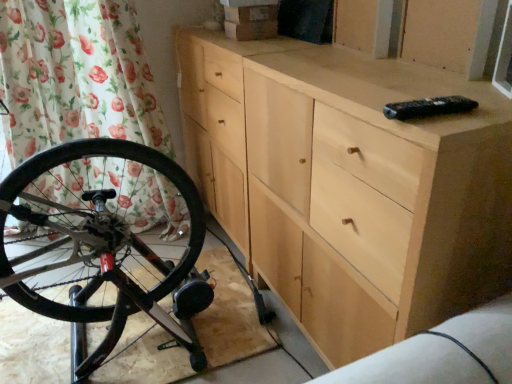
Question: Is clear glass window screen at upper right looking in the opposite direction of natural wood chest of drawers at center?

Choices:
 (A) yes
 (B) no

Answer: (B)

Question: Are clear glass window screen at upper right and natural wood chest of drawers at center located far from each other?

Choices:
 (A) no
 (B) yes

Answer: (A)

Question: Can you confirm if clear glass window screen at upper right is taller than natural wood chest of drawers at center?

Choices:
 (A) no
 (B) yes

Answer: (A)

Question: Is clear glass window screen at upper right oriented towards natural wood chest of drawers at center?

Choices:
 (A) yes
 (B) no

Answer: (B)

Question: Considering the relative positions of clear glass window screen at upper right and natural wood chest of drawers at center in the image provided, is clear glass window screen at upper right in front of natural wood chest of drawers at center?

Choices:
 (A) yes
 (B) no

Answer: (B)

Question: Considering the positions of clear glass window screen at upper right and natural wood chest of drawers at center in the image, is clear glass window screen at upper right wider or thinner than natural wood chest of drawers at center?

Choices:
 (A) thin
 (B) wide

Answer: (A)

Question: Does point (506, 94) appear closer or farther from the camera than point (474, 122)?

Choices:
 (A) farther
 (B) closer

Answer: (A)

Question: Is clear glass window screen at upper right taller or shorter than natural wood chest of drawers at center?

Choices:
 (A) tall
 (B) short

Answer: (B)

Question: Considering the positions of clear glass window screen at upper right and natural wood chest of drawers at center in the image, is clear glass window screen at upper right bigger or smaller than natural wood chest of drawers at center?

Choices:
 (A) big
 (B) small

Answer: (B)

Question: Do you think floral fabric curtain at left is within clear glass window screen at upper right, or outside of it?

Choices:
 (A) outside
 (B) inside

Answer: (A)

Question: Considering the positions of point (87, 122) and point (497, 71), is point (87, 122) closer or farther from the camera than point (497, 71)?

Choices:
 (A) farther
 (B) closer

Answer: (A)

Question: Based on their sizes in the image, would you say floral fabric curtain at left is bigger or smaller than clear glass window screen at upper right?

Choices:
 (A) small
 (B) big

Answer: (B)

Question: Is floral fabric curtain at left in front of or behind clear glass window screen at upper right in the image?

Choices:
 (A) behind
 (B) front

Answer: (A)

Question: Considering the positions of point click(x=152, y=185) and point click(x=356, y=145), is point click(x=152, y=185) closer or farther from the camera than point click(x=356, y=145)?

Choices:
 (A) farther
 (B) closer

Answer: (A)

Question: In the image, is floral fabric curtain at left on the left side or the right side of natural wood chest of drawers at center?

Choices:
 (A) left
 (B) right

Answer: (A)